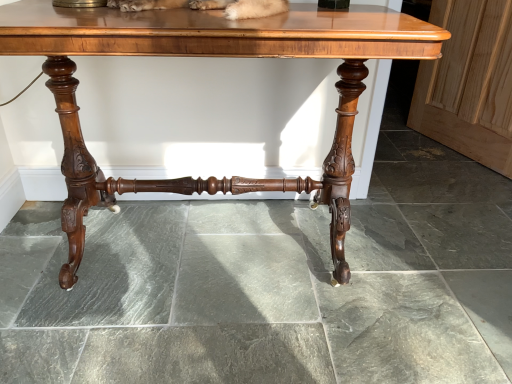
Where is `vacant location below polished wood table at center (from a real-world perspective)`? vacant location below polished wood table at center (from a real-world perspective) is located at coordinates (217, 245).